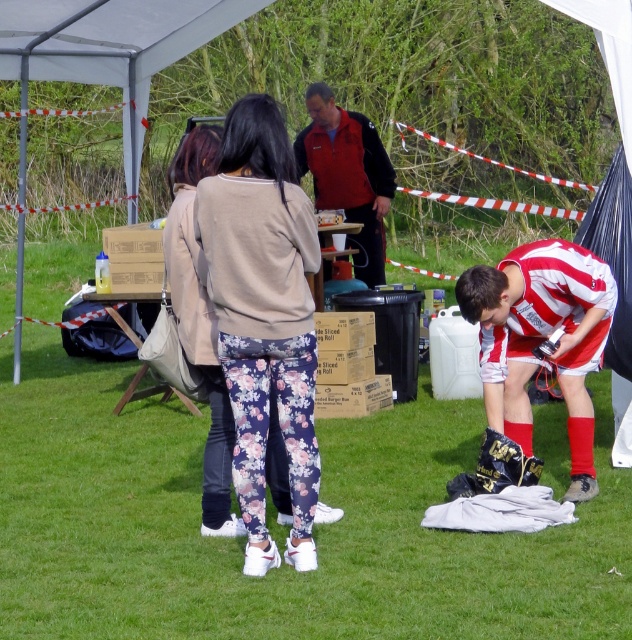
Who is positioned more to the left, green grass at lower center or red jacket at center?

green grass at lower center

Can you confirm if green grass at lower center is positioned below red jacket at center?

Correct, green grass at lower center is located below red jacket at center.

In order to click on green grass at lower center in this screenshot , I will do `click(245, 538)`.

Does striped jersey at lower right come behind red jacket at center?

No, striped jersey at lower right is closer to the viewer.

Does point (538, 353) come behind point (384, 177)?

No, (538, 353) is closer to viewer.

You are a GUI agent. You are given a task and a screenshot of the screen. Output one action in this format:
    pyautogui.click(x=<x>, y=<y>)
    Task: Click on the striped jersey at lower right
    
    Given the screenshot: What is the action you would take?
    pyautogui.click(x=542, y=340)

Between green grass at lower center and floral leggings at center, which one has more height?

floral leggings at center is taller.

Does point (428, 429) come closer to viewer compared to point (267, 292)?

No, it is behind (267, 292).

Who is more distant from viewer, (x=368, y=584) or (x=240, y=387)?

The point (x=240, y=387) is behind.

Identify the location of green grass at lower center. This screenshot has height=640, width=632. (245, 538).